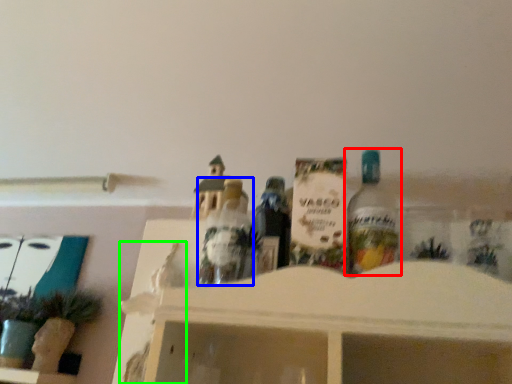
Question: Which object is positioned farthest from bottle (highlighted by a red box)? Select from toy (highlighted by a blue box) and toy (highlighted by a green box).

Choices:
 (A) toy
 (B) toy

Answer: (B)